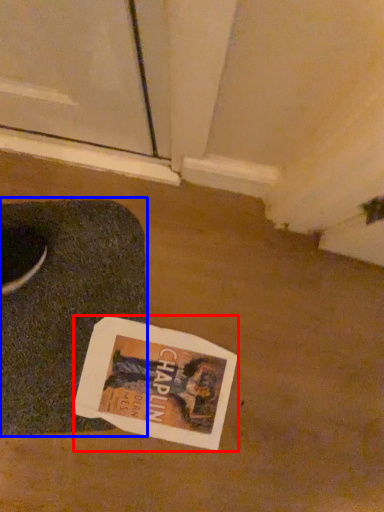
Question: Among these objects, which one is farthest to the camera, magazine (highlighted by a red box) or yoga mat (highlighted by a blue box)?

Choices:
 (A) magazine
 (B) yoga mat

Answer: (A)